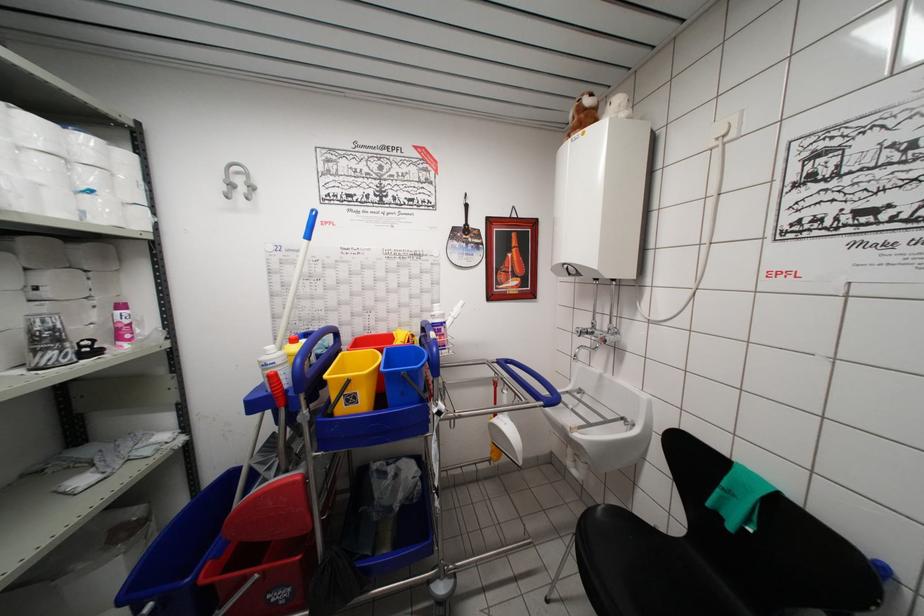
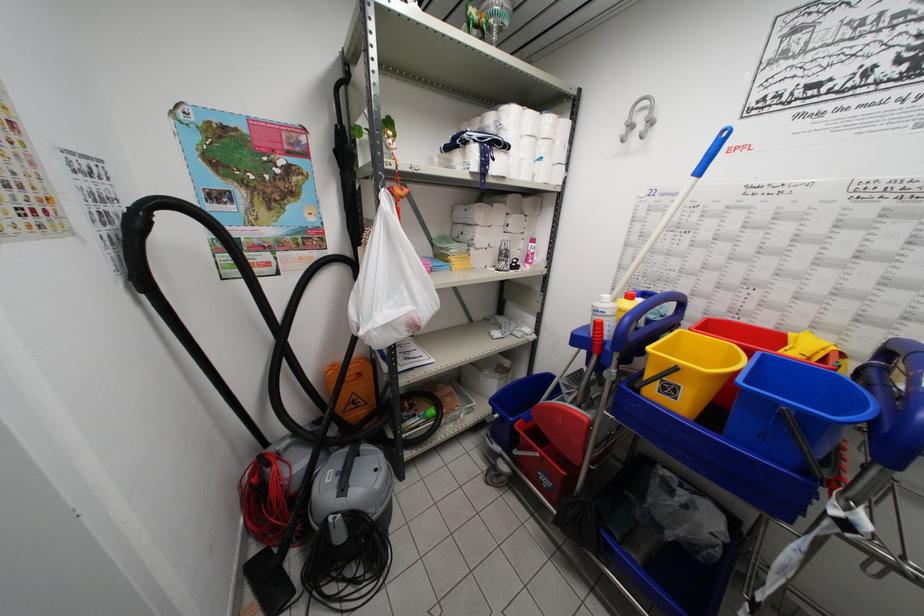
How did the camera likely rotate?

The camera's rotation is toward left-down.